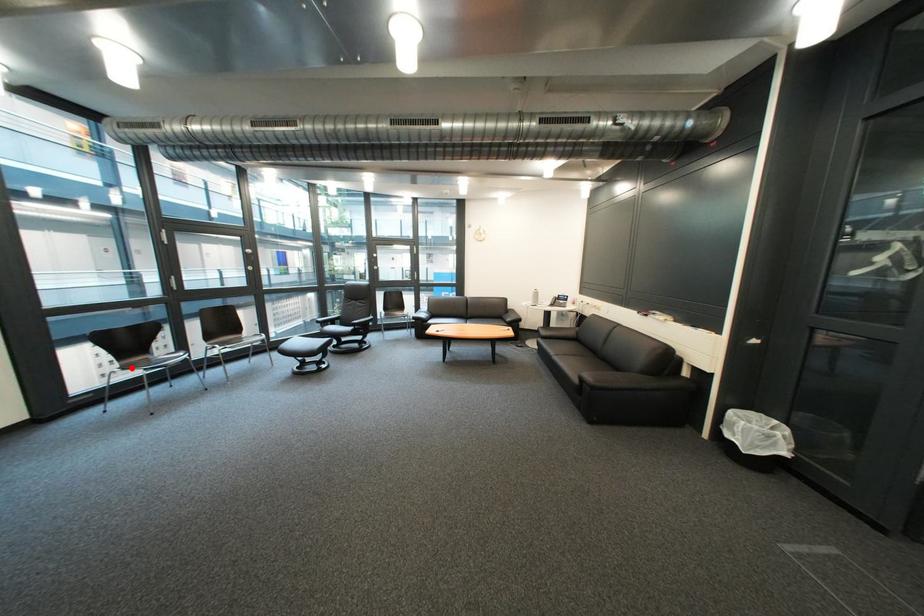
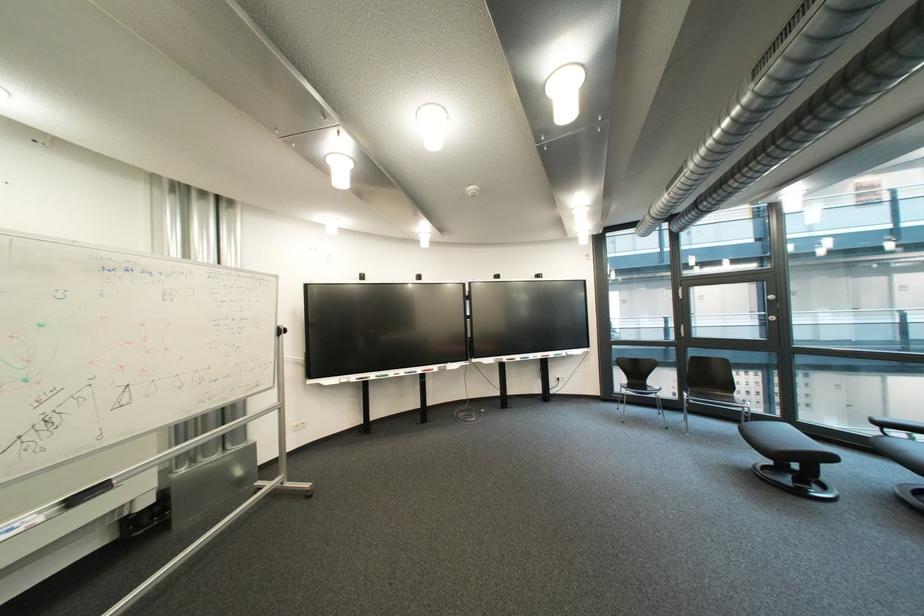
Find the pixel in the second image that matches the highlighted location in the first image.

(638, 385)